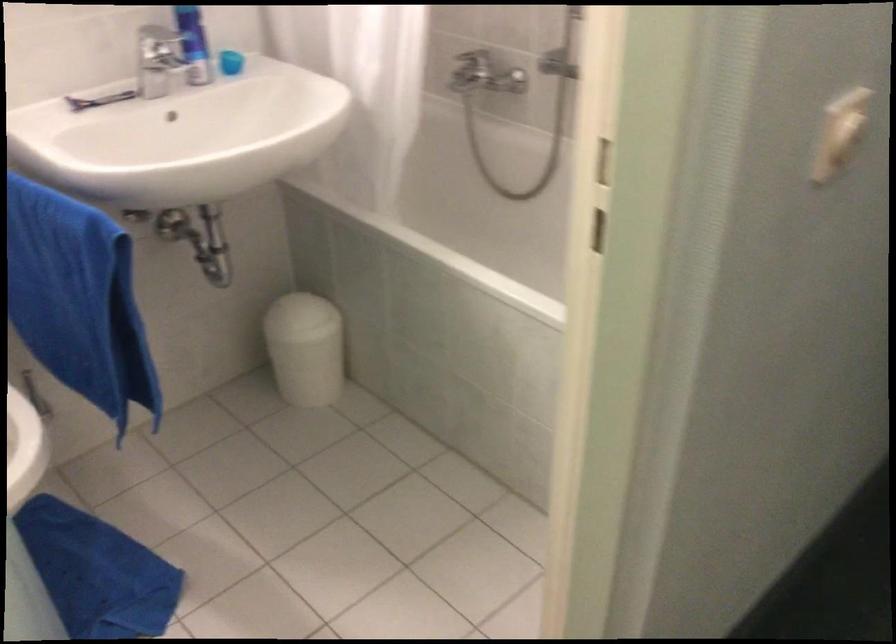
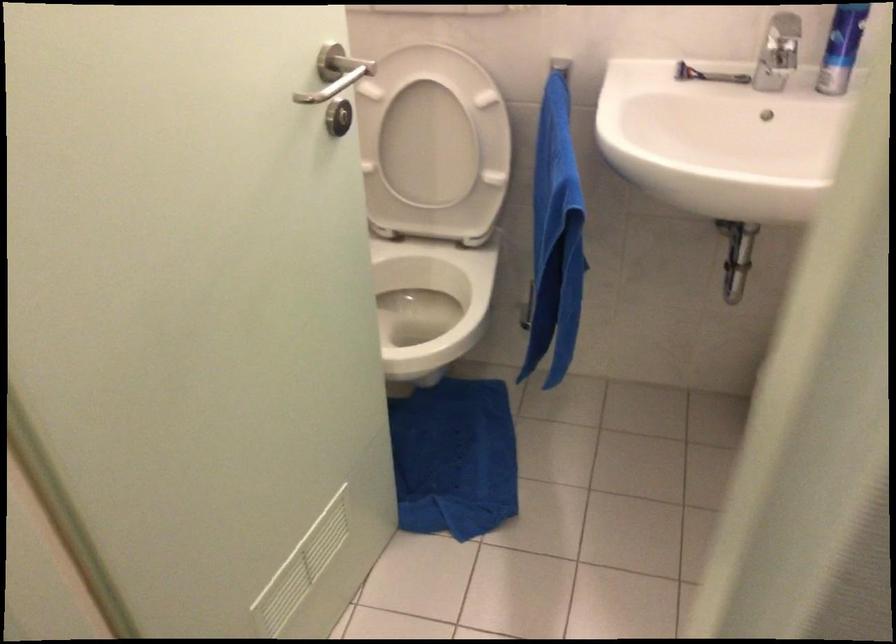
How did the camera likely rotate?

The rotation direction of the camera is left-down.